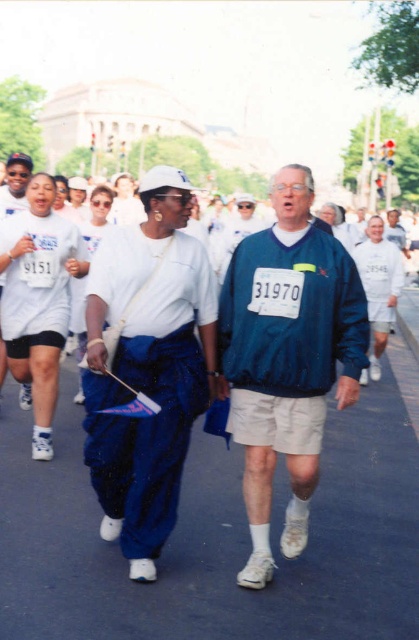
Is blue fabric at center to the right of white cotton t-shirt at center from the viewer's perspective?

Yes, blue fabric at center is to the right of white cotton t-shirt at center.

Does blue fabric at center lie in front of white cotton t-shirt at center?

Yes, blue fabric at center is closer to the viewer.

Between point (403, 484) and point (22, 196), which one is positioned behind?

The point (22, 196) is behind.

Locate an element on the screen. blue fabric at center is located at coordinates (216, 538).

Is white cotton shirt at center bigger than white cotton t-shirt at center?

No.

Find the location of `white cotton shirt at center`. white cotton shirt at center is located at coordinates (147, 365).

At what (x,y) coordinates should I click in order to perform the action: click on white cotton shirt at center. Please return your answer as a coordinate pair (x, y). This screenshot has height=640, width=419. Looking at the image, I should click on (147, 365).

Does blue fabric at center appear on the left side of blue fabric jacket at center?

Yes, blue fabric at center is to the left of blue fabric jacket at center.

Between blue fabric at center and blue fabric jacket at center, which one has more height?

blue fabric jacket at center

Who is more distant from viewer, (x=382, y=497) or (x=304, y=225)?

Point (x=382, y=497)

The image size is (419, 640). I want to click on blue fabric at center, so click(x=216, y=538).